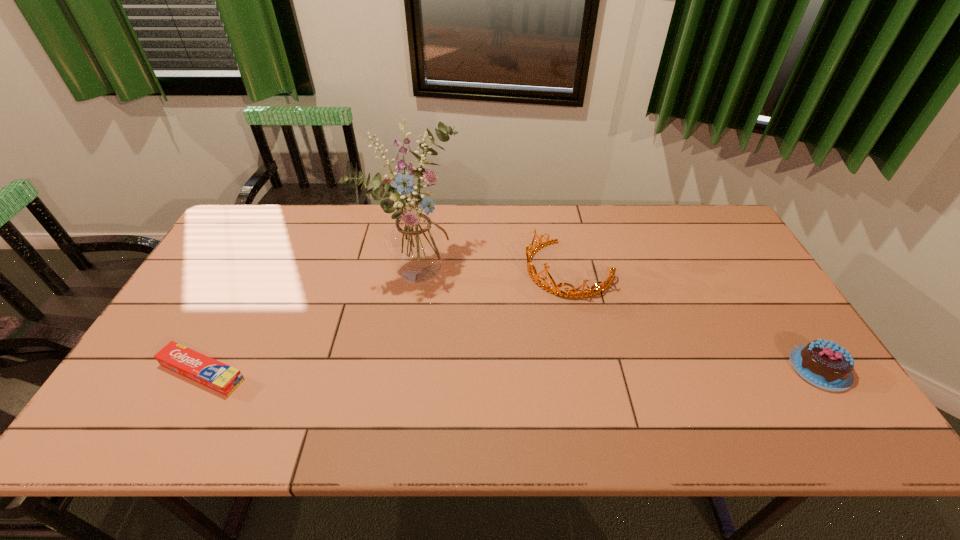
Image resolution: width=960 pixels, height=540 pixels. I want to click on vacant space that is in between the third object from left to right and the chocolate cake, so click(694, 319).

The height and width of the screenshot is (540, 960). Identify the location of free space that is in between the second tallest object and the second object from left to right. (492, 269).

Identify the location of free space that is in between the second shortest object and the tallest object. (618, 319).

Where is `free area in between the chocolate cake and the shortest object`? The width and height of the screenshot is (960, 540). free area in between the chocolate cake and the shortest object is located at coordinates (511, 370).

What are the coordinates of `free space between the leftmost object and the tiara` in the screenshot? It's located at (386, 321).

Where is `free area in between the rightmost object and the leftmost object`? The width and height of the screenshot is (960, 540). free area in between the rightmost object and the leftmost object is located at coordinates (511, 370).

I want to click on free space between the tiara and the leftmost object, so click(386, 321).

Find the location of a particular element. Image resolution: width=960 pixels, height=540 pixels. free space between the second tallest object and the tallest object is located at coordinates (492, 269).

This screenshot has width=960, height=540. What are the coordinates of `blank region between the third tallest object and the tallest object` in the screenshot? It's located at (618, 319).

Find the location of a particular element. free space between the second object from left to right and the rightmost object is located at coordinates (618, 319).